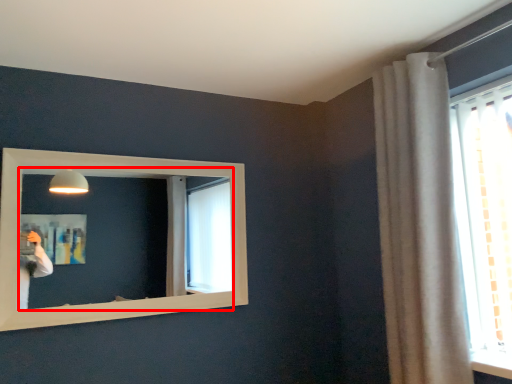
Question: In this image, where is mirror (annotated by the red box) located relative to curtain?

Choices:
 (A) left
 (B) right

Answer: (A)